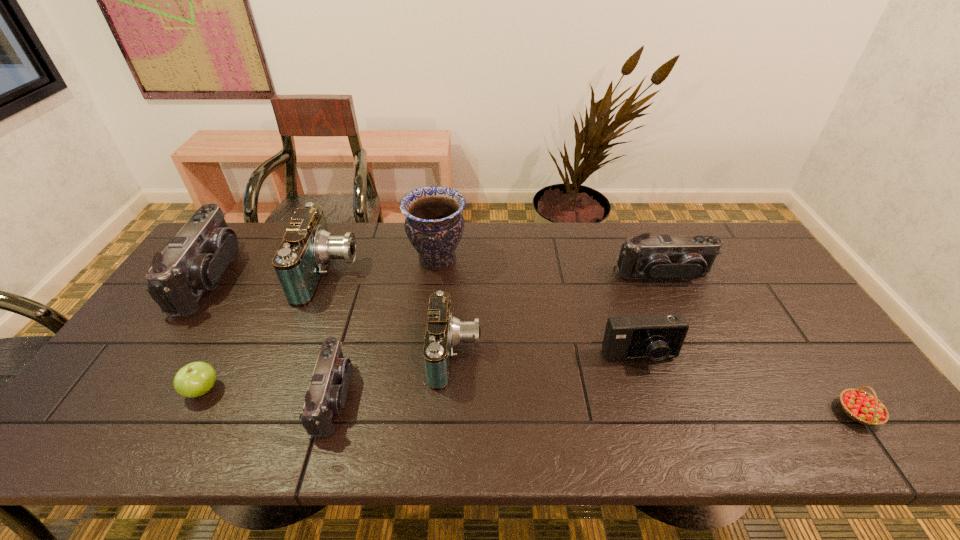
Find the location of a particular element. The height and width of the screenshot is (540, 960). black camcorder object that ranks as the closest to the green apple is located at coordinates (194, 260).

Locate an element on the screen. The image size is (960, 540). black camcorder that is the closest to the biggest black camcorder is located at coordinates (326, 395).

This screenshot has width=960, height=540. Identify the location of vacant area in the image that satisfies the following two spatial constraints: 1. on the front-facing side of the blue camera; 2. on the front-facing side of the smallest black camcorder. point(653,397).

The image size is (960, 540). I want to click on vacant position in the image that satisfies the following two spatial constraints: 1. on the front-facing side of the right blue camcorder; 2. on the right side of the shortest object, so click(452, 413).

I want to click on free location that satisfies the following two spatial constraints: 1. on the front-facing side of the blue camera; 2. on the front-facing side of the shortest camcorder, so [653, 397].